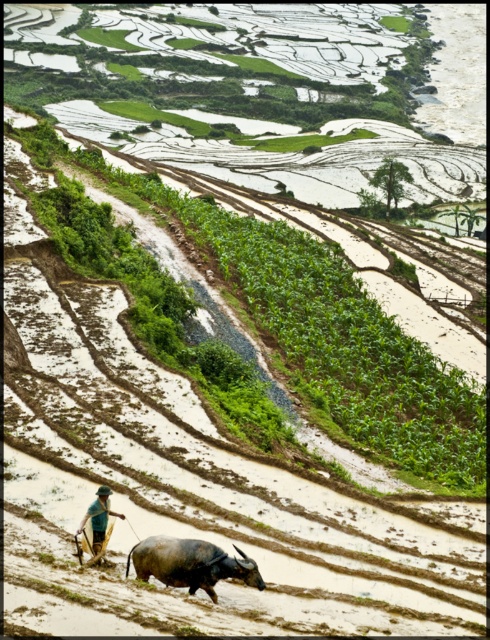
Question: Can you confirm if dark gray textured bull at lower center is bigger than green fabric hat at lower center?

Choices:
 (A) no
 (B) yes

Answer: (B)

Question: Which of the following is the closest to the observer?

Choices:
 (A) green fabric hat at lower center
 (B) dark gray textured bull at lower center

Answer: (B)

Question: In this image, where is dark gray textured bull at lower center located relative to green fabric hat at lower center?

Choices:
 (A) right
 (B) left

Answer: (A)

Question: Which point appears closest to the camera in this image?

Choices:
 (A) (206, 550)
 (B) (104, 500)

Answer: (A)

Question: Is dark gray textured bull at lower center further to camera compared to green fabric hat at lower center?

Choices:
 (A) no
 (B) yes

Answer: (A)